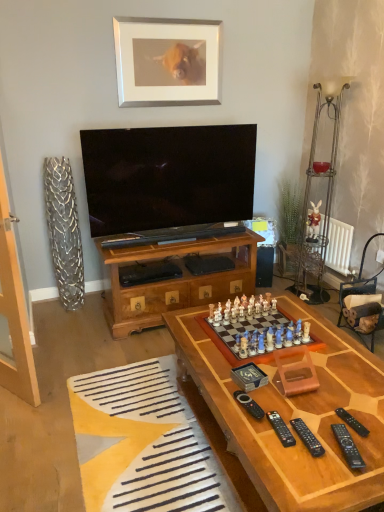
I want to click on vacant area that lies between black plastic remote at lower right, the first remote when ordered from right to left, and black plastic remote at lower right, the 4th remote in the right-to-left sequence, so click(314, 424).